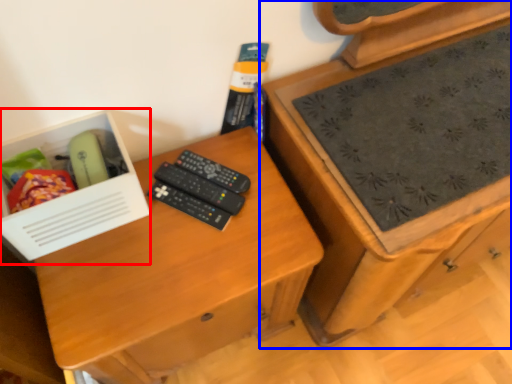
Question: Which of the following is the farthest to the observer, box (highlighted by a red box) or chest of drawers (highlighted by a blue box)?

Choices:
 (A) box
 (B) chest of drawers

Answer: (B)